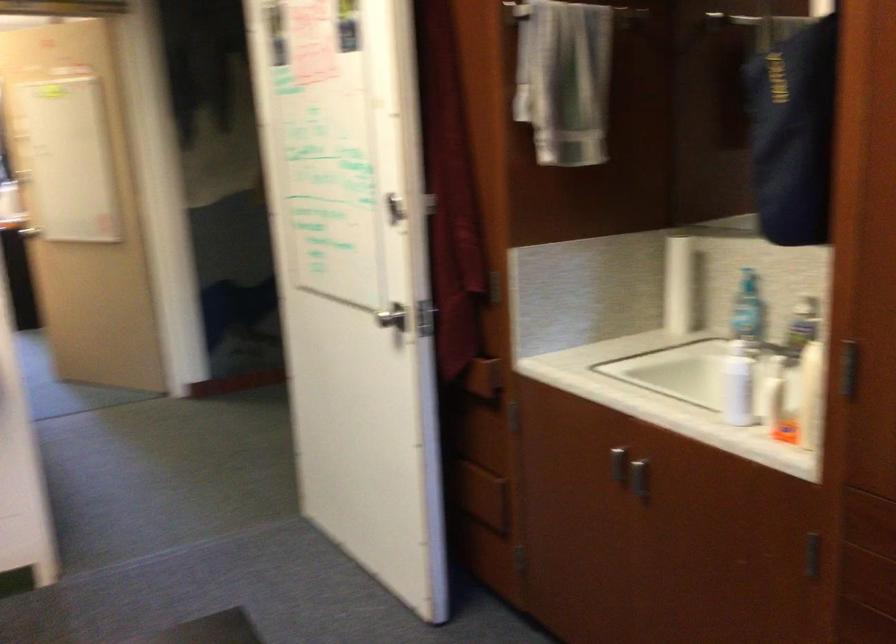
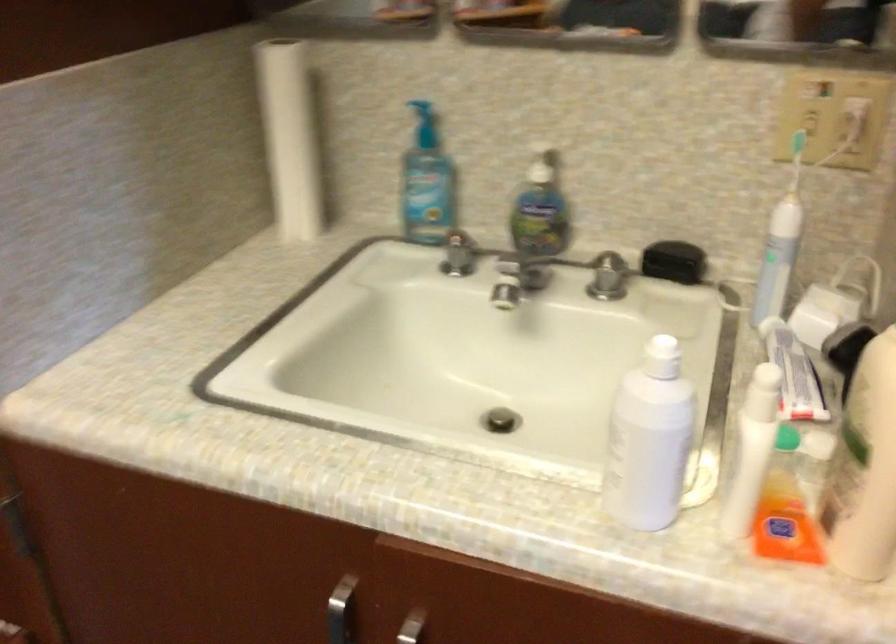
Find the pixel in the second image that matches pixel 617 451 in the first image.

(340, 611)